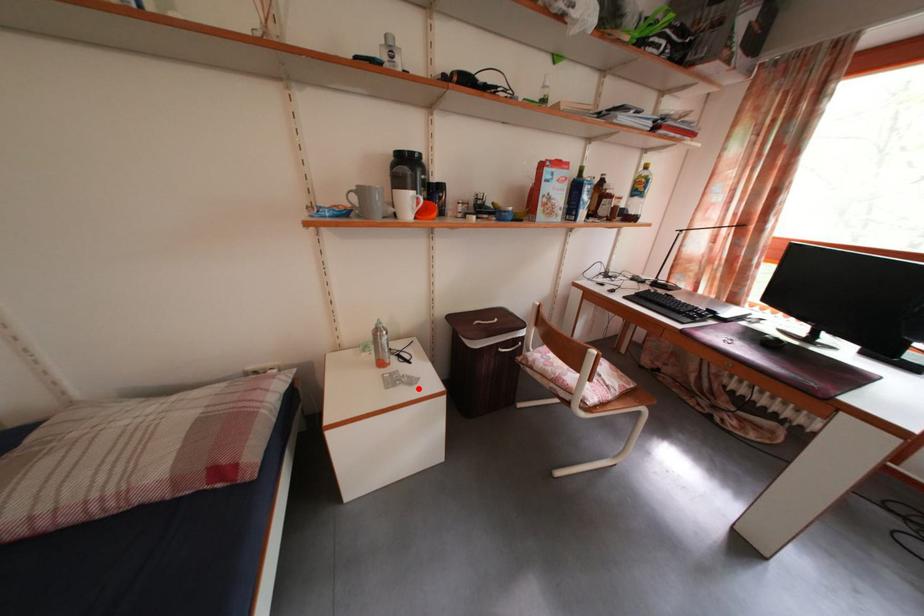
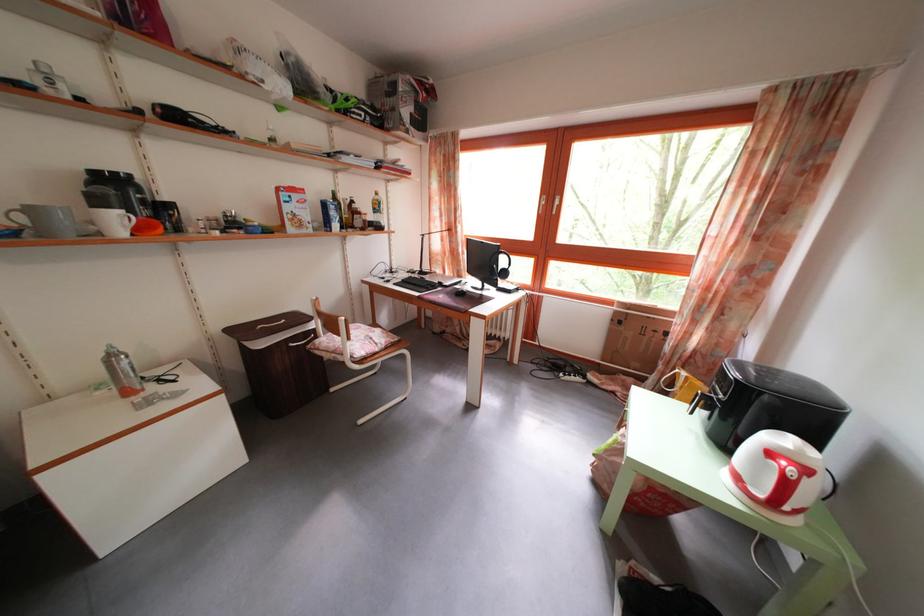
Where in the second image is the point corresponding to the highlighted location from the first image?

(185, 402)